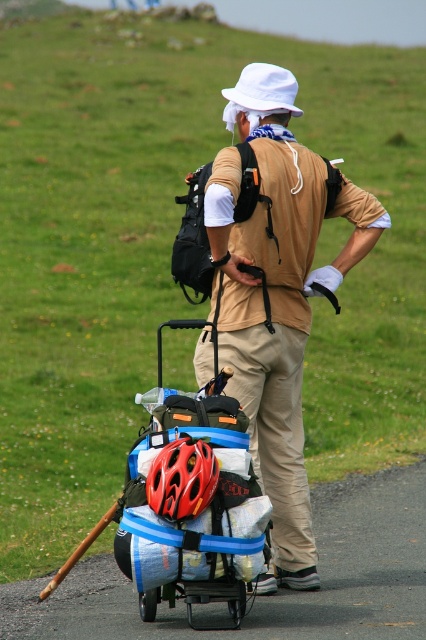
You are trying to determine if the matte black wagon at center can fit under a low hanging tree branch that is at the same height as the khaki pants at center. Based on their heights, will the wagon fit under the branch?

The matte black wagon at center has a lesser height compared to khaki pants at center. Since the branch is at the same height as the khaki pants at center, the wagon will fit under the branch because it is shorter than the pants, which matches the branch height.

You are standing at the starting point and see the matte black wagon at center. If the distance between you and the wagon is 5.81 meters, how many steps would you need to take to reach it if each of your steps is 0.75 meters long?

Since the distance between you and the matte black wagon at center is 5.81 meters and each step covers 0.75 meters, you would need approximately 8 steps to reach it. This is calculated by dividing 5.81 by 0.75, which equals about 7.75, rounded up to 8 steps.